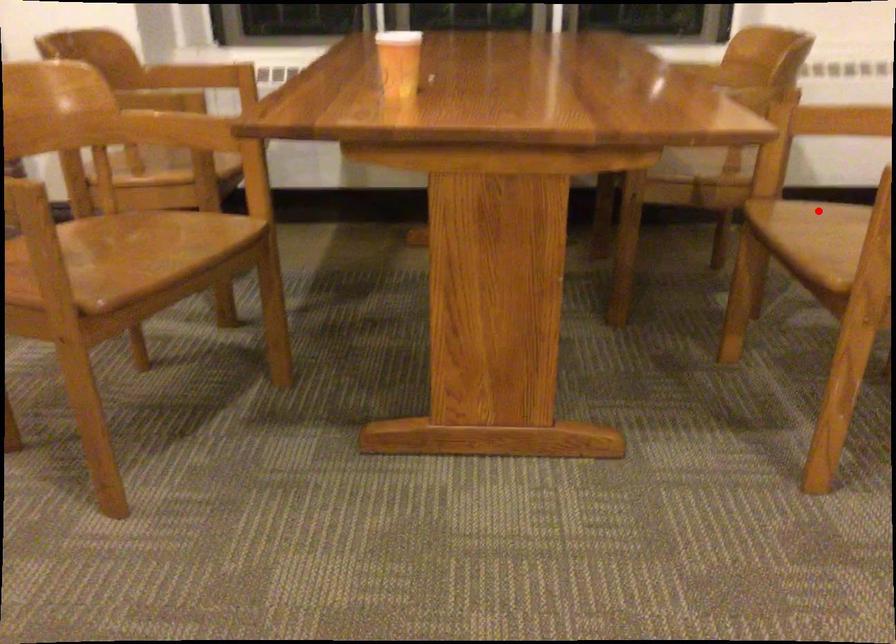
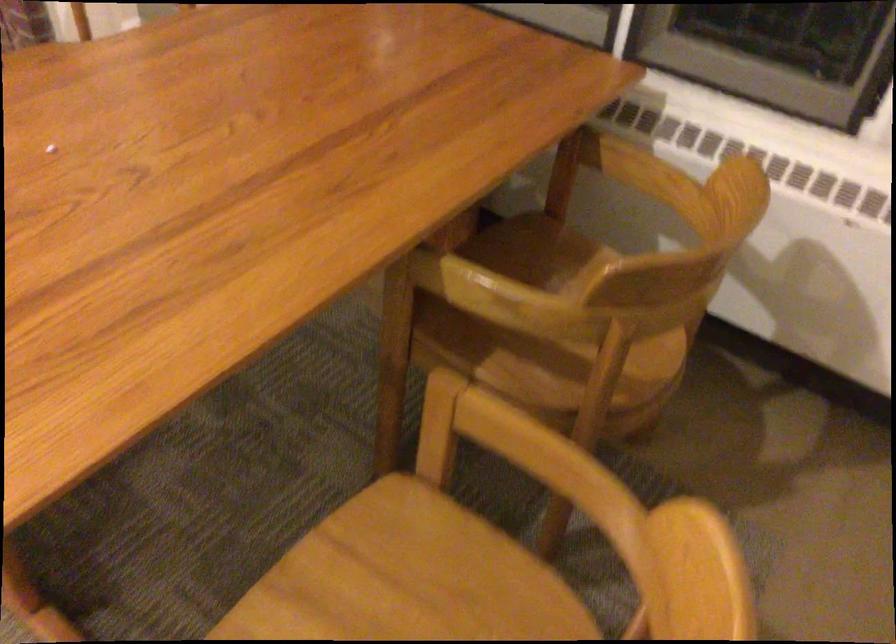
Where in the second image is the point corresponding to the highlighted location from the first image?

(407, 579)